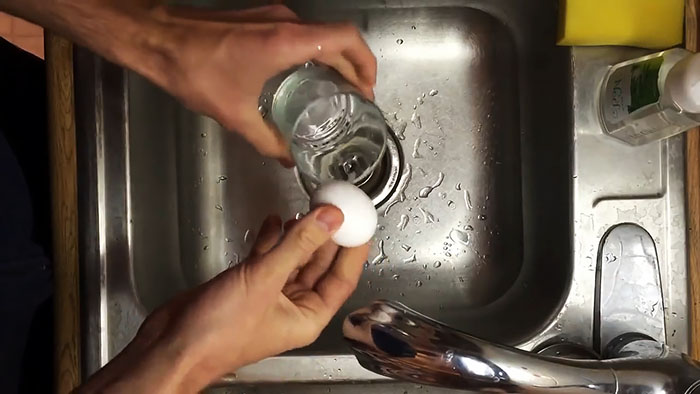
What are the coordinates of `soap` in the screenshot? It's located at (x=656, y=101).